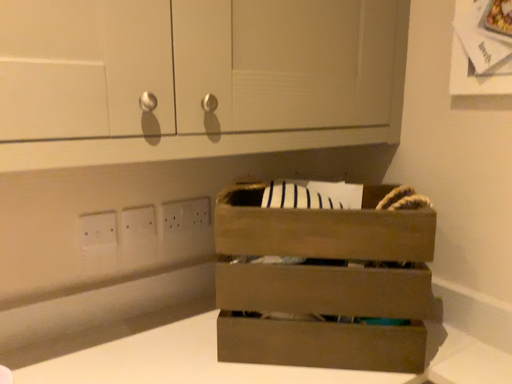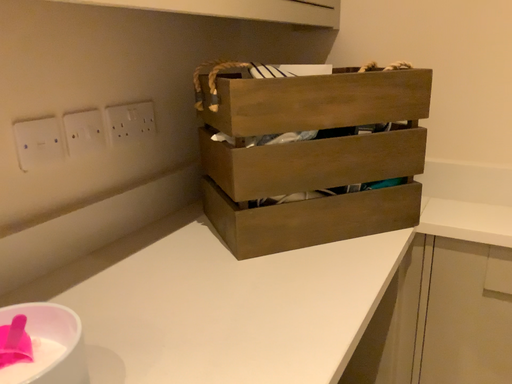
Question: How did the camera likely rotate when shooting the video?

Choices:
 (A) rotated right
 (B) rotated left

Answer: (A)